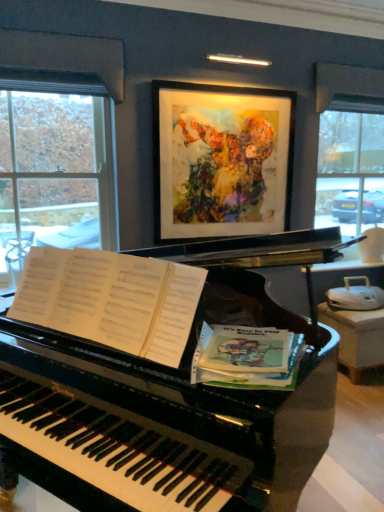
Measure the distance between clear glass window at left and camera.

They are 8.35 feet apart.

What do you see at coordinates (155, 406) in the screenshot? The image size is (384, 512). I see `glossy black piano at center` at bounding box center [155, 406].

Find the location of a particular element. green paper at piano right is located at coordinates (247, 357).

Is green paper at piano right to the right of clear glass window at left from the viewer's perspective?

Indeed, green paper at piano right is positioned on the right side of clear glass window at left.

Who is smaller, green paper at piano right or clear glass window at left?

green paper at piano right.

From a real-world perspective, which object stands above the other?

clear glass window at left, from a real-world perspective.

Could you tell me if glossy black piano at center is facing green paper at piano right?

Yes.

Is glossy black piano at center taller than green paper at piano right?

Yes.

Can you see green paper at piano right touching watercolor painting at upper center?

green paper at piano right is not next to watercolor painting at upper center, and they're not touching.

The height and width of the screenshot is (512, 384). Identify the location of paperback book below the watercolor painting at upper center (from a real-world perspective). (247, 357).

Is point (276, 362) less distant than point (225, 201)?

Yes, it is.

Between watercolor painting at upper center and clear glass window at left, which one appears on the right side from the viewer's perspective?

watercolor painting at upper center.

Does watercolor painting at upper center turn towards clear glass window at left?

No.

Can you confirm if watercolor painting at upper center is taller than clear glass window at left?

In fact, watercolor painting at upper center may be shorter than clear glass window at left.

How different are the orientations of watercolor painting at upper center and clear glass window at left in degrees?

0.325 degrees.

Is watercolor painting at upper center not within green paper at piano right?

Absolutely, watercolor painting at upper center is external to green paper at piano right.

Which of these two, watercolor painting at upper center or green paper at piano right, stands taller?

Standing taller between the two is watercolor painting at upper center.

Can you confirm if watercolor painting at upper center is thinner than green paper at piano right?

Yes, watercolor painting at upper center is thinner than green paper at piano right.

From a real-world perspective, which object rests below the other?

From a 3D spatial view, green paper at piano right is below.

Does watercolor painting at upper center contain glossy black piano at center?

No, watercolor painting at upper center does not contain glossy black piano at center.

Is glossy black piano at center at the back of watercolor painting at upper center?

watercolor painting at upper center is not turned away from glossy black piano at center.

Considering the sizes of objects watercolor painting at upper center and glossy black piano at center in the image provided, who is smaller, watercolor painting at upper center or glossy black piano at center?

watercolor painting at upper center.

Which is more distant, (x=280, y=143) or (x=240, y=438)?

Positioned behind is point (x=280, y=143).

Which of these two, clear glass window at left or green paper at piano right, stands shorter?

green paper at piano right is shorter.

From a real-world perspective, is clear glass window at left below green paper at piano right?

Actually, clear glass window at left is physically above green paper at piano right in the real world.

Is clear glass window at left positioned with its back to green paper at piano right?

No, clear glass window at left is not facing away from green paper at piano right.

From the image's perspective, is clear glass window at left located beneath green paper at piano right?

No.

This screenshot has height=512, width=384. In order to click on window located behind the green paper at piano right in this screenshot , I will do `click(54, 170)`.

Identify the location of paperback book that is above the glossy black piano at center (from the image's perspective). The image size is (384, 512). (247, 357).

Estimate the real-world distances between objects in this image. Which object is closer to watercolor painting at upper center, clear glass window at left or green paper at piano right?

clear glass window at left lies closer to watercolor painting at upper center than the other object.

Estimate the real-world distances between objects in this image. Which object is closer to glossy black piano at center, green paper at piano right or watercolor painting at upper center?

Among the two, green paper at piano right is located nearer to glossy black piano at center.

When comparing their distances from green paper at piano right, does glossy black piano at center or clear glass window at left seem further?

clear glass window at left is further to green paper at piano right.

Which object lies nearer to the anchor point clear glass window at left, glossy black piano at center or watercolor painting at upper center?

The object closer to clear glass window at left is watercolor painting at upper center.

Looking at the image, which one is located further to watercolor painting at upper center, green paper at piano right or glossy black piano at center?

green paper at piano right.

Looking at the image, which one is located closer to green paper at piano right, clear glass window at left or glossy black piano at center?

glossy black piano at center lies closer to green paper at piano right than the other object.

Looking at the image, which one is located further to green paper at piano right, watercolor painting at upper center or glossy black piano at center?

watercolor painting at upper center.

Estimate the real-world distances between objects in this image. Which object is further from watercolor painting at upper center, glossy black piano at center or clear glass window at left?

glossy black piano at center is positioned further to the anchor watercolor painting at upper center.

Image resolution: width=384 pixels, height=512 pixels. Identify the location of paperback book between glossy black piano at center and clear glass window at left from front to back. (247, 357).

Where is `paperback book between glossy black piano at center and watercolor painting at upper center in the front-back direction`? paperback book between glossy black piano at center and watercolor painting at upper center in the front-back direction is located at coordinates (247, 357).

Identify the location of window between glossy black piano at center and watercolor painting at upper center from front to back. (54, 170).

This screenshot has height=512, width=384. In order to click on window between green paper at piano right and watercolor painting at upper center in the front-back direction in this screenshot , I will do `click(54, 170)`.